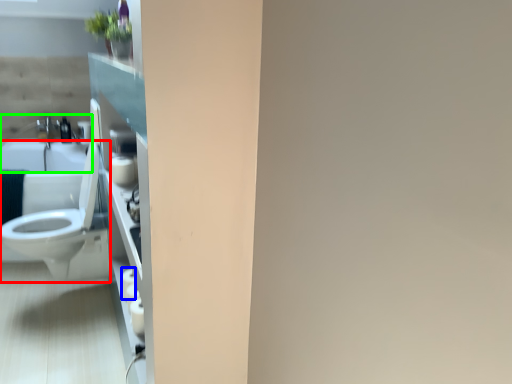
Question: Which object is positioned closest to toilet (highlighted by a red box)? Select from toilet paper (highlighted by a blue box) and sink (highlighted by a green box).

Choices:
 (A) toilet paper
 (B) sink

Answer: (A)